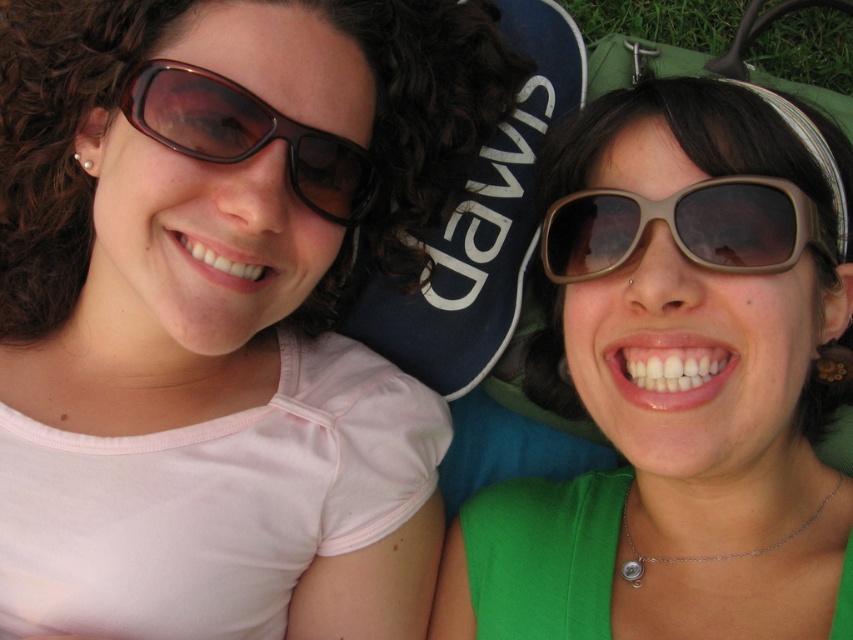
Question: Which is nearer to the matte brown sunglasses at center?

Choices:
 (A) brown matte sunglasses at left
 (B) matte brown sunglasses at right
 (C) green grass at upper right

Answer: (B)

Question: Is the position of matte brown sunglasses at right more distant than that of green grass at upper right?

Choices:
 (A) yes
 (B) no

Answer: (B)

Question: Which of the following is the farthest from the observer?

Choices:
 (A) (223, 160)
 (B) (675, 307)

Answer: (A)

Question: Which point is closer to the camera?

Choices:
 (A) (332, 634)
 (B) (566, 413)
 (C) (697, 212)
 (D) (724, 24)

Answer: (C)

Question: In this image, where is matte brown sunglasses at right located relative to brown matte sunglasses at left?

Choices:
 (A) below
 (B) above

Answer: (A)

Question: Is matte brown sunglasses at center positioned in front of green grass at upper right?

Choices:
 (A) yes
 (B) no

Answer: (A)